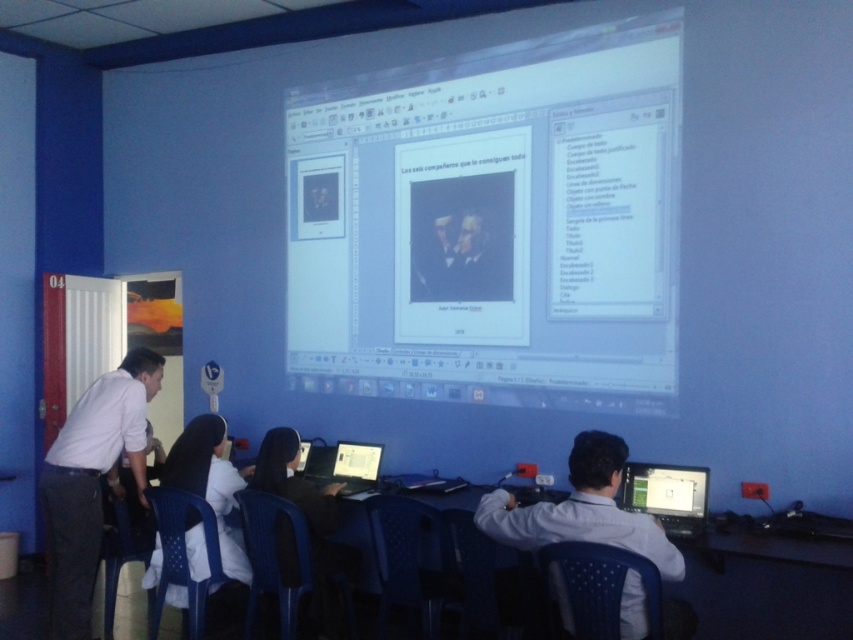
Which is more to the right, white shirt at left or white shirt at lower right?

white shirt at lower right is more to the right.

Which is above, white shirt at left or white shirt at lower right?

white shirt at lower right

Identify the location of white shirt at left. This screenshot has width=853, height=640. (91, 481).

Which is in front, point (614, 364) or point (367, 481)?

Point (614, 364) is more forward.

Is white glossy projector screen at upper center further to camera compared to black glossy laptop at center?

That is False.

Image resolution: width=853 pixels, height=640 pixels. Describe the element at coordinates (492, 225) in the screenshot. I see `white glossy projector screen at upper center` at that location.

The width and height of the screenshot is (853, 640). I want to click on white glossy projector screen at upper center, so click(492, 225).

Who is lower down, white glossy projector screen at upper center or white shirt at left?

white shirt at left is lower down.

From the picture: Can you confirm if white glossy projector screen at upper center is positioned below white shirt at left?

Actually, white glossy projector screen at upper center is above white shirt at left.

Is point (300, 120) positioned in front of point (91, 529)?

No, (300, 120) is behind (91, 529).

Identify the location of white glossy projector screen at upper center. (492, 225).